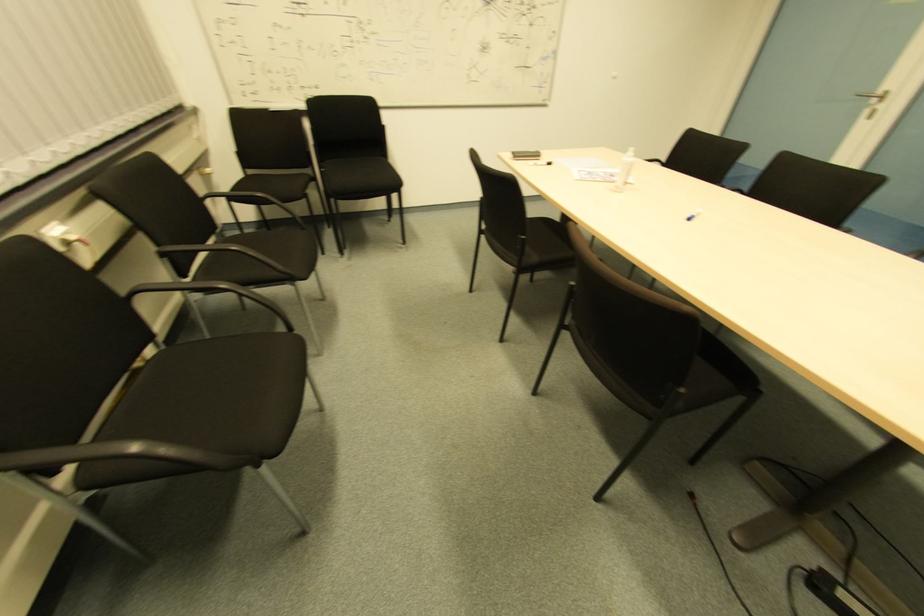
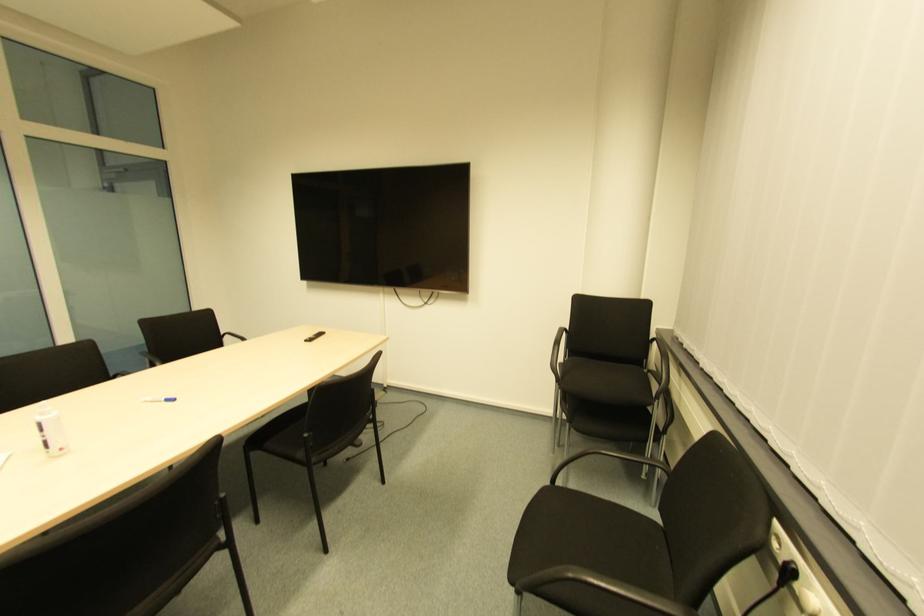
Find the pixel in the second image that matches point (688, 222) in the first image.

(172, 403)